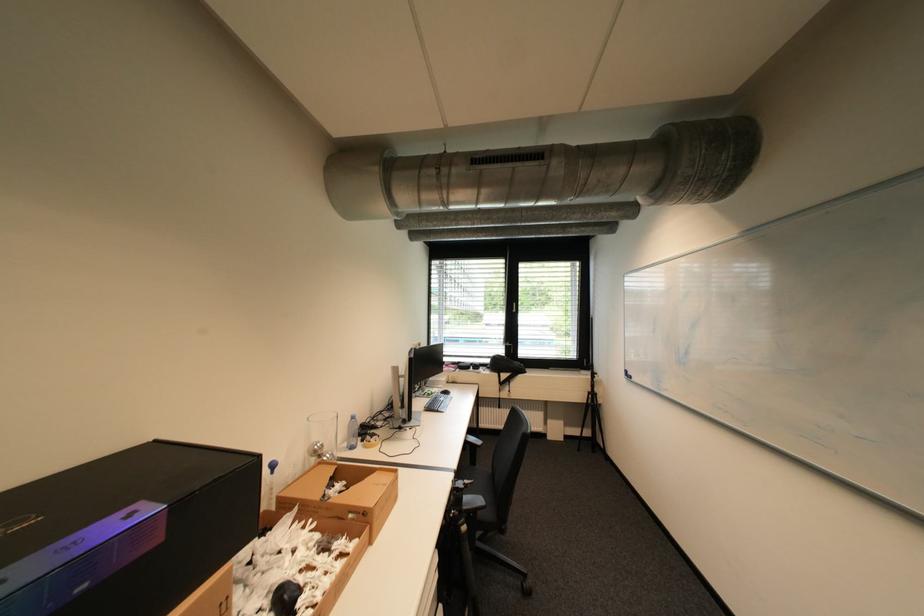
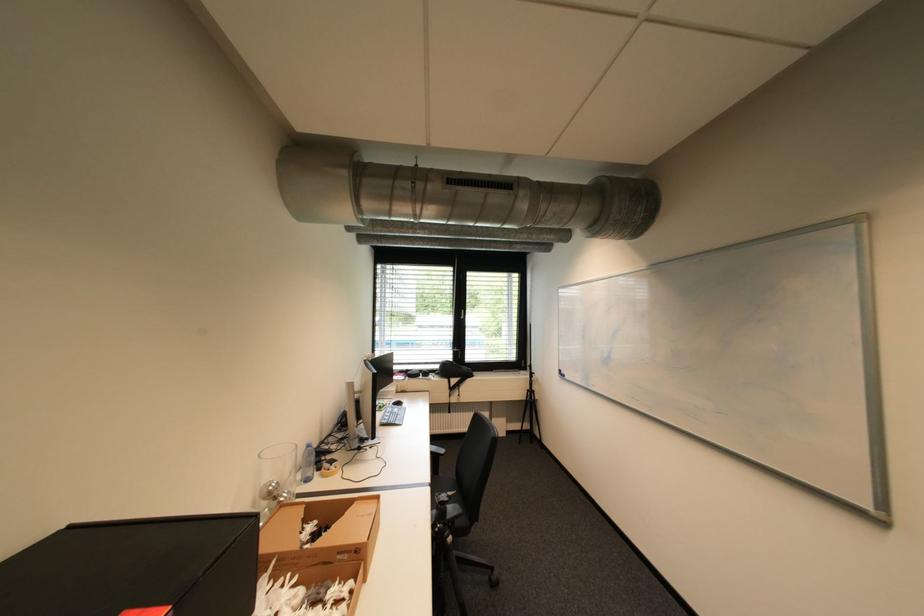
The point at (x=593, y=402) is marked in the first image. Where is the corresponding point in the second image?

(532, 400)